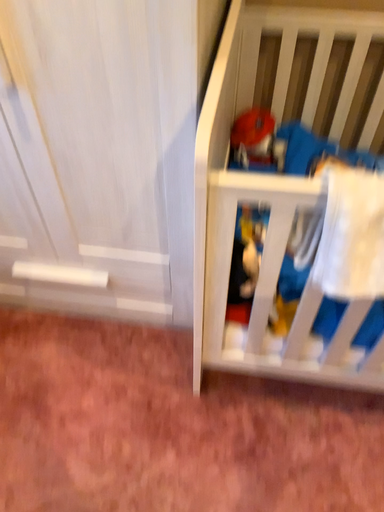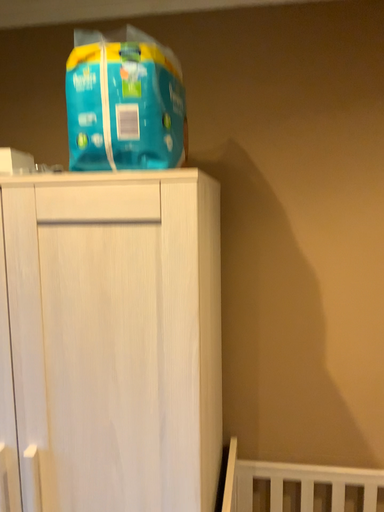
Question: Which way did the camera rotate in the video?

Choices:
 (A) rotated upward
 (B) rotated downward

Answer: (A)